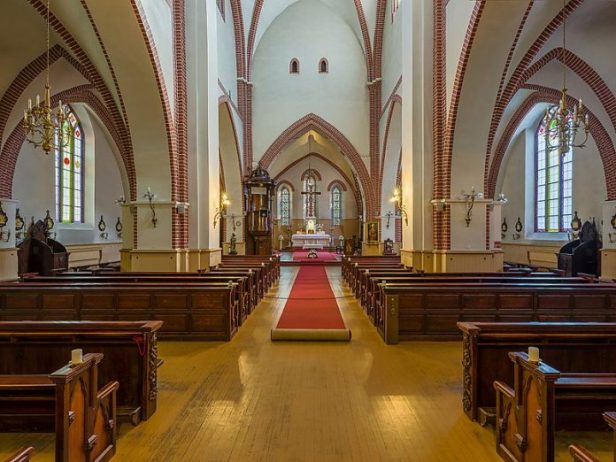
Where is `carpet`? The width and height of the screenshot is (616, 462). carpet is located at coordinates (309, 305).